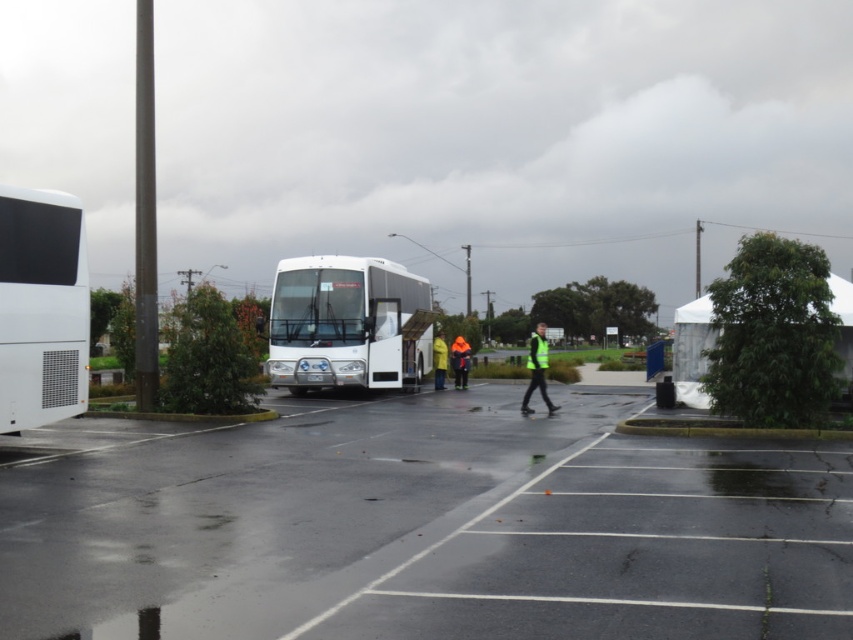
Which of these two, black asphalt parking lot at lower left or green leafy tree at center, stands shorter?

black asphalt parking lot at lower left

Is black asphalt parking lot at lower left further to camera compared to green leafy tree at center?

No, black asphalt parking lot at lower left is in front of green leafy tree at center.

Identify the location of black asphalt parking lot at lower left. [x=422, y=525].

Between point (782, 342) and point (498, 339), which one is positioned in front?

Positioned in front is point (782, 342).

Is point (746, 362) positioned in front of point (489, 320)?

Yes, point (746, 362) is in front of point (489, 320).

Where is `green leafy tree at right`? green leafy tree at right is located at coordinates (773, 333).

Which is behind, point (329, 522) or point (759, 364)?

Point (759, 364)

Is point (216, 541) behind point (730, 387)?

No.

In order to click on black asphalt parking lot at lower left in this screenshot , I will do `click(422, 525)`.